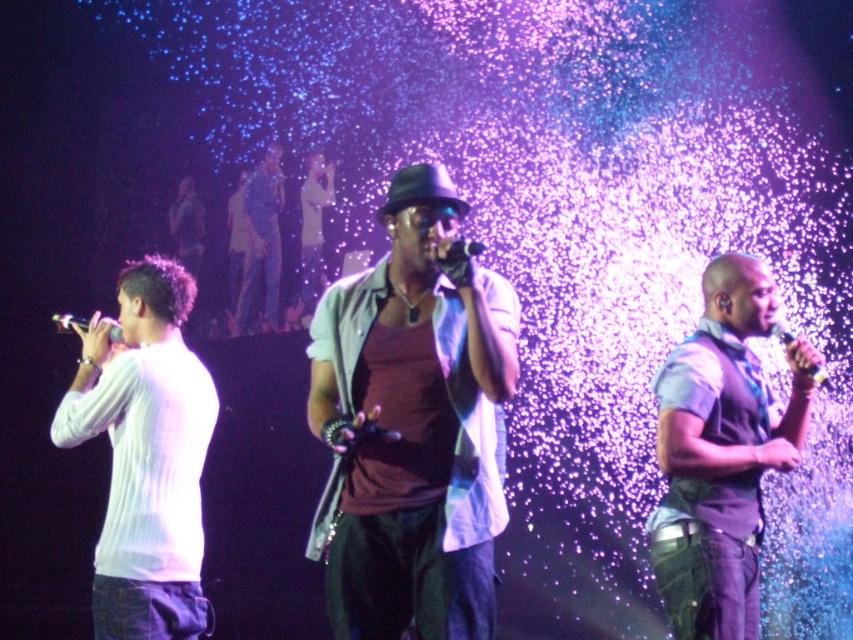
Who is positioned more to the right, matte black hat at center or white ribbed sweater at left?

Positioned to the right is matte black hat at center.

Which is behind, point (340, 314) or point (169, 518)?

The point (169, 518) is more distant.

Locate an element on the screen. matte black hat at center is located at coordinates (412, 426).

Is white ribbed sweater at left closer to camera compared to matte black microphone at left?

Yes.

Can you confirm if white ribbed sweater at left is thinner than matte black microphone at left?

In fact, white ribbed sweater at left might be wider than matte black microphone at left.

What do you see at coordinates (144, 456) in the screenshot? I see `white ribbed sweater at left` at bounding box center [144, 456].

Where is `white ribbed sweater at left`? The image size is (853, 640). white ribbed sweater at left is located at coordinates click(x=144, y=456).

Does matte black hat at center appear on the right side of purple matte vest at center?

Incorrect, matte black hat at center is not on the right side of purple matte vest at center.

From the picture: Can you confirm if matte black hat at center is thinner than purple matte vest at center?

No, matte black hat at center is not thinner than purple matte vest at center.

This screenshot has height=640, width=853. Find the location of `matte black hat at center`. matte black hat at center is located at coordinates (412, 426).

This screenshot has height=640, width=853. In order to click on matte black hat at center in this screenshot , I will do `click(412, 426)`.